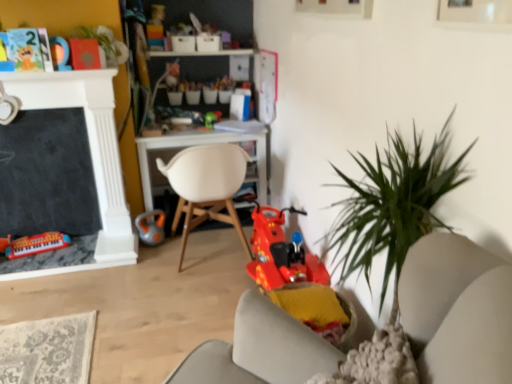
Locate an element on the screen. This screenshot has height=384, width=512. free space in front of white matte chair at center is located at coordinates (174, 304).